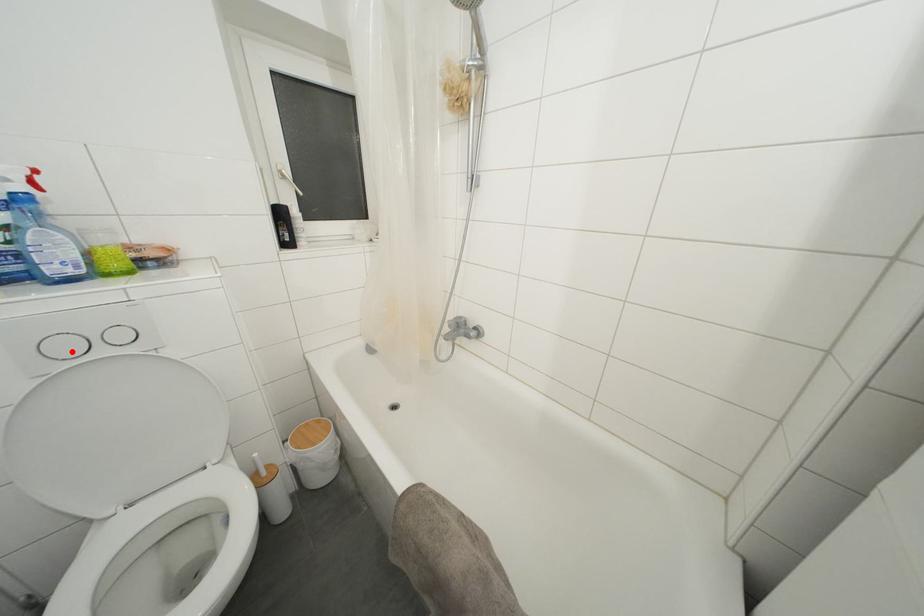
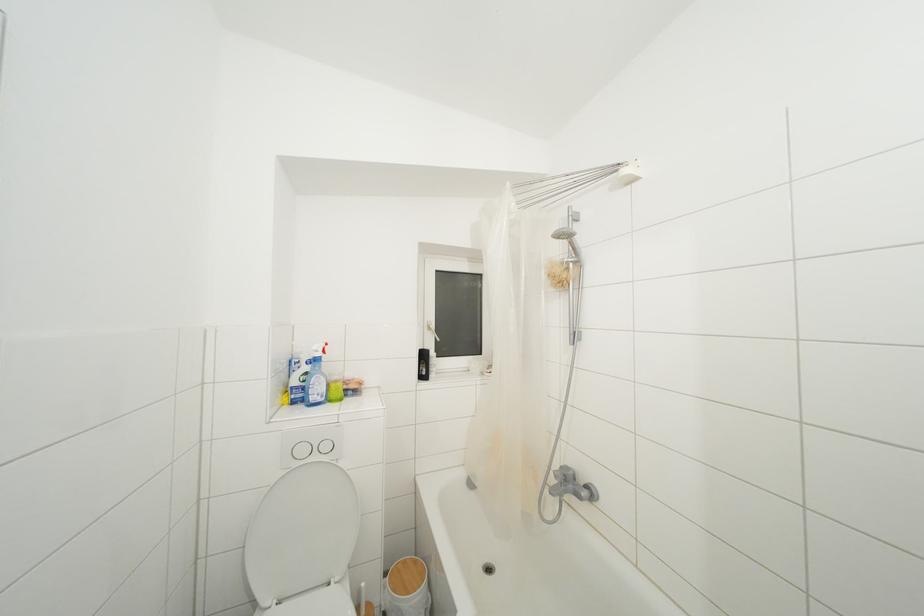
Question: I am providing you with two images of the same scene from different viewpoints. A red point is shown in image1. For the corresponding object point in image2, is it positioned nearer or farther from the camera?

Choices:
 (A) Nearer
 (B) Farther

Answer: (A)